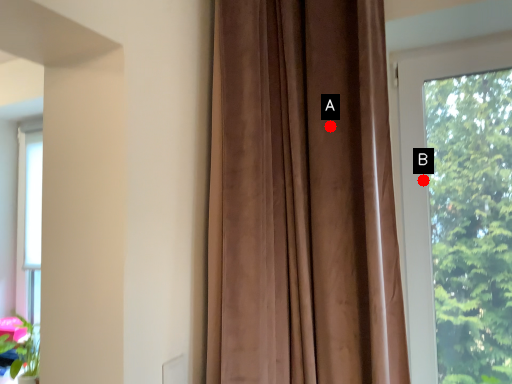
Question: Two points are circled on the image, labeled by A and B beside each circle. Which point is farther from the camera taking this photo?

Choices:
 (A) A is further
 (B) B is further

Answer: (B)